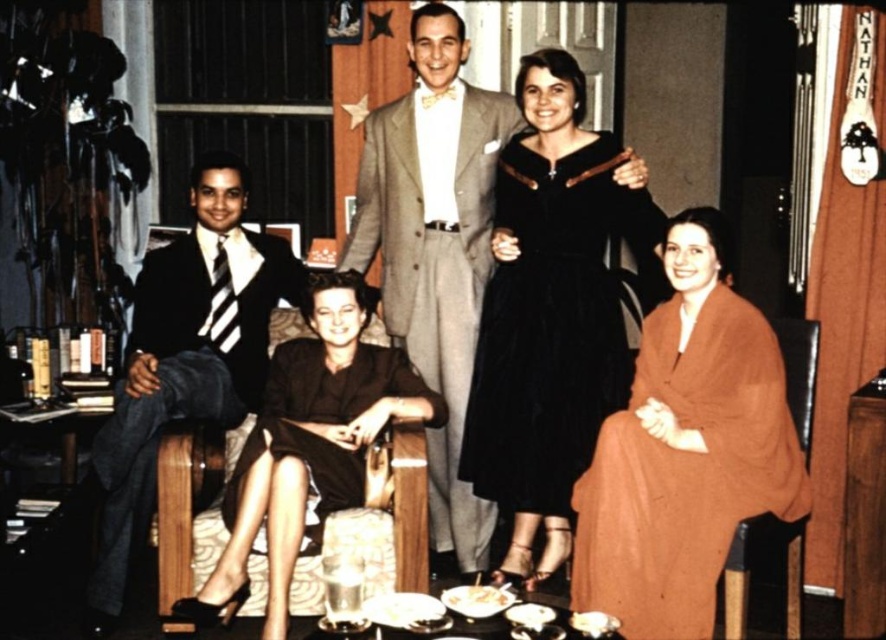
Question: Where is velvet black dress at center located in relation to light gray wool suit at center in the image?

Choices:
 (A) left
 (B) right

Answer: (B)

Question: Which object appears closest to the camera in this image?

Choices:
 (A) black wool suit at left
 (B) brown woolen shawl at lower right
 (C) brown satin dress at center

Answer: (C)

Question: Which of these objects is positioned farthest from the light gray wool suit at center?

Choices:
 (A) brown woolen shawl at lower right
 (B) brown satin dress at center

Answer: (A)

Question: Estimate the real-world distances between objects in this image. Which object is farther from the brown woolen shawl at lower right?

Choices:
 (A) brown satin dress at center
 (B) velvet black dress at center
 (C) black wool suit at left
 (D) light gray wool suit at center

Answer: (C)

Question: Does brown woolen shawl at lower right have a lesser width compared to light gray wool suit at center?

Choices:
 (A) no
 (B) yes

Answer: (A)

Question: Does brown woolen shawl at lower right have a smaller size compared to velvet black dress at center?

Choices:
 (A) yes
 (B) no

Answer: (B)